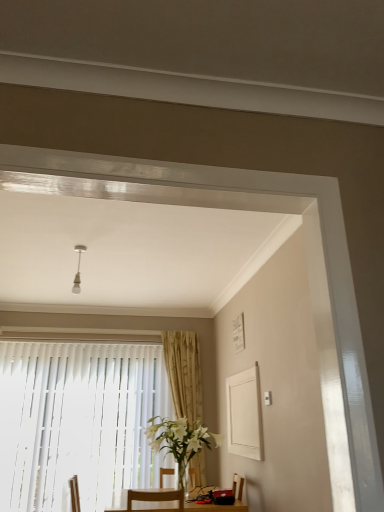
Question: Would you consider white vertical blinds at lower left to be distant from white glass vase at center?

Choices:
 (A) yes
 (B) no

Answer: (A)

Question: From the image's perspective, does white vertical blinds at lower left appear lower than white glass vase at center?

Choices:
 (A) no
 (B) yes

Answer: (B)

Question: Can you confirm if white vertical blinds at lower left is thinner than white glass vase at center?

Choices:
 (A) yes
 (B) no

Answer: (A)

Question: Considering the relative sizes of white vertical blinds at lower left and white glass vase at center in the image provided, is white vertical blinds at lower left taller than white glass vase at center?

Choices:
 (A) yes
 (B) no

Answer: (A)

Question: Does white vertical blinds at lower left have a larger size compared to white glass vase at center?

Choices:
 (A) yes
 (B) no

Answer: (A)

Question: Considering the positions of white vertical blinds at lower left and white glass vase at center in the image, is white vertical blinds at lower left bigger or smaller than white glass vase at center?

Choices:
 (A) big
 (B) small

Answer: (A)

Question: Considering their positions, is white vertical blinds at lower left located in front of or behind white glass vase at center?

Choices:
 (A) behind
 (B) front

Answer: (A)

Question: Is white vertical blinds at lower left spatially inside white glass vase at center, or outside of it?

Choices:
 (A) inside
 (B) outside

Answer: (B)

Question: In terms of height, does white vertical blinds at lower left look taller or shorter compared to white glass vase at center?

Choices:
 (A) short
 (B) tall

Answer: (B)

Question: Considering the positions of gold textured curtain at center and white glass vase at center in the image, is gold textured curtain at center wider or thinner than white glass vase at center?

Choices:
 (A) thin
 (B) wide

Answer: (A)

Question: Does point (196, 455) appear closer or farther from the camera than point (175, 422)?

Choices:
 (A) farther
 (B) closer

Answer: (A)

Question: Based on their sizes in the image, would you say gold textured curtain at center is bigger or smaller than white glass vase at center?

Choices:
 (A) big
 (B) small

Answer: (B)

Question: In the image, is gold textured curtain at center on the left side or the right side of white glass vase at center?

Choices:
 (A) right
 (B) left

Answer: (B)

Question: Is white glass vase at center bigger or smaller than white vertical blinds at lower left?

Choices:
 (A) small
 (B) big

Answer: (A)

Question: From a real-world perspective, relative to white vertical blinds at lower left, is white glass vase at center vertically above or below?

Choices:
 (A) above
 (B) below

Answer: (B)